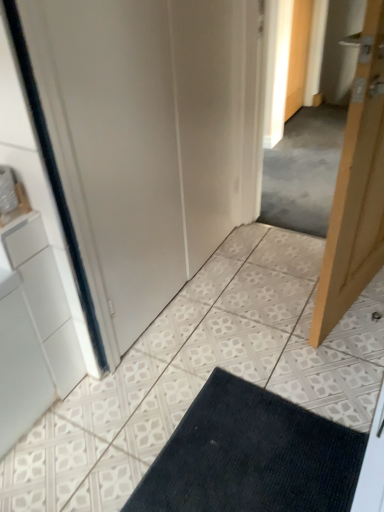
Question: Would you say light wood door at right, acting as the first door starting from the front, is part of dark blue textured bath mat at lower center's contents?

Choices:
 (A) no
 (B) yes

Answer: (A)

Question: Is dark blue textured bath mat at lower center facing towards light wood door at right, placed as the 2th door when sorted from back to front?

Choices:
 (A) no
 (B) yes

Answer: (B)

Question: Is dark blue textured bath mat at lower center taller than light wood door at right, marked as the first door in a bottom-to-top arrangement?

Choices:
 (A) yes
 (B) no

Answer: (B)

Question: From a real-world perspective, is dark blue textured bath mat at lower center positioned under light wood door at right, placed as the 2th door when sorted from back to front, based on gravity?

Choices:
 (A) yes
 (B) no

Answer: (A)

Question: From the image's perspective, is dark blue textured bath mat at lower center on light wood door at right, acting as the first door starting from the front?

Choices:
 (A) yes
 (B) no

Answer: (B)

Question: Can you confirm if dark blue textured bath mat at lower center is thinner than light wood door at right, acting as the first door starting from the front?

Choices:
 (A) no
 (B) yes

Answer: (A)

Question: Considering the relative sizes of white matte door at center and light wood door at right, acting as the first door starting from the front, in the image provided, is white matte door at center shorter than light wood door at right, acting as the first door starting from the front,?

Choices:
 (A) yes
 (B) no

Answer: (B)

Question: From the image's perspective, is white matte door at center located above light wood door at right, placed as the 2th door when sorted from back to front?

Choices:
 (A) no
 (B) yes

Answer: (B)

Question: Is white matte door at center smaller than light wood door at right, marked as the first door in a bottom-to-top arrangement?

Choices:
 (A) no
 (B) yes

Answer: (A)

Question: From a real-world perspective, is white matte door at center under light wood door at right, marked as the first door in a bottom-to-top arrangement?

Choices:
 (A) no
 (B) yes

Answer: (A)

Question: Is white matte door at center behind light wood door at right, marked as the first door in a bottom-to-top arrangement?

Choices:
 (A) no
 (B) yes

Answer: (A)

Question: Is white matte door at center positioned beyond the bounds of light wood door at right, placed as the 2th door when sorted from back to front?

Choices:
 (A) yes
 (B) no

Answer: (A)

Question: From a real-world perspective, is wooden door at upper right, which is counted as the 2th door, starting from the front, on top of dark blue textured bath mat at lower center?

Choices:
 (A) yes
 (B) no

Answer: (A)